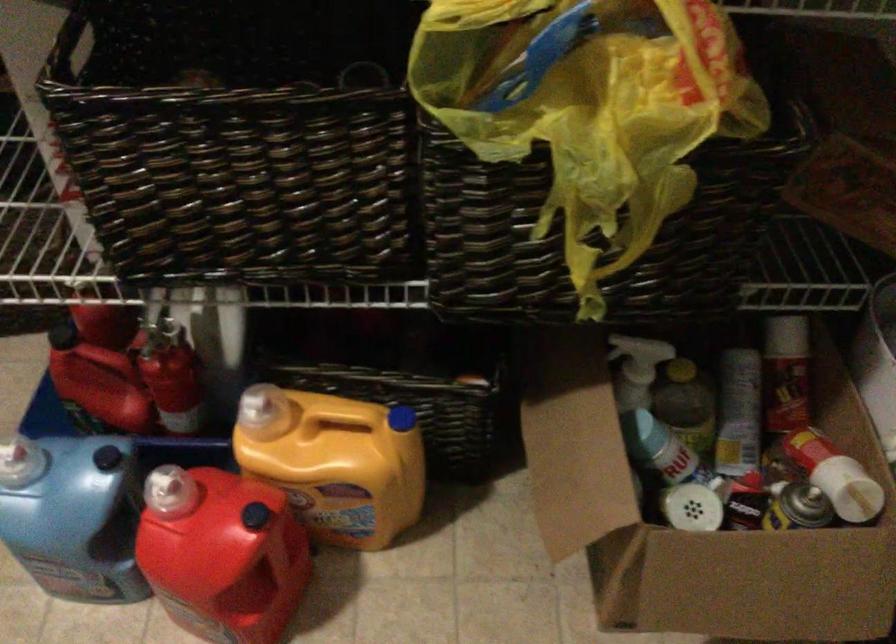
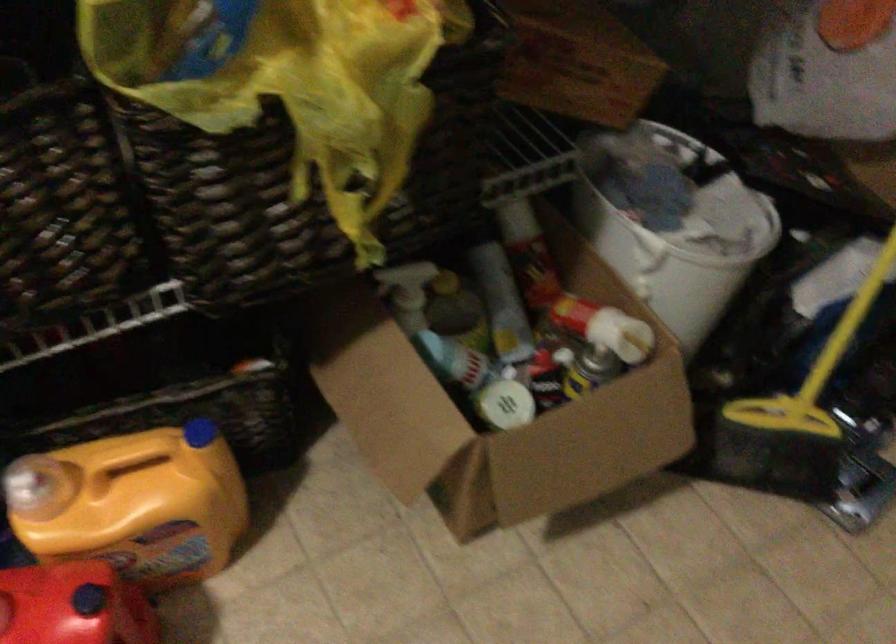
In the second image, find the point that corresponds to [822,462] in the first image.

(595, 319)